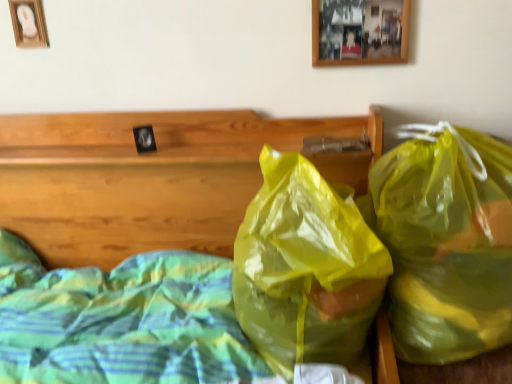
Question: Is translucent yellow plastic bag at center, which is counted as the second plastic bag, starting from the right, oriented towards wooden picture frame at upper center, the second picture frame positioned from the left?

Choices:
 (A) yes
 (B) no

Answer: (B)

Question: From the image's perspective, does translucent yellow plastic bag at center, which is counted as the second plastic bag, starting from the right, appear lower than wooden picture frame at upper center, acting as the 2th picture frame starting from the back?

Choices:
 (A) no
 (B) yes

Answer: (B)

Question: From a real-world perspective, does translucent yellow plastic bag at center, which is counted as the second plastic bag, starting from the right, sit lower than wooden picture frame at upper center, the second picture frame positioned from the left?

Choices:
 (A) yes
 (B) no

Answer: (A)

Question: Is translucent yellow plastic bag at center, which is counted as the second plastic bag, starting from the right, positioned in front of wooden picture frame at upper center, the second picture frame positioned from the left?

Choices:
 (A) no
 (B) yes

Answer: (B)

Question: From the image's perspective, is translucent yellow plastic bag at center, marked as the 1th plastic bag in a left-to-right arrangement, over wooden picture frame at upper center, the 1th picture frame positioned from the front?

Choices:
 (A) no
 (B) yes

Answer: (A)

Question: Does translucent yellow plastic bag at center, marked as the 1th plastic bag in a left-to-right arrangement, have a lesser width compared to wooden picture frame at upper center, the second picture frame positioned from the left?

Choices:
 (A) yes
 (B) no

Answer: (B)

Question: Is translucent yellow plastic bag at right, which is counted as the 1th plastic bag, starting from the right, taller than translucent plastic bags at center?

Choices:
 (A) yes
 (B) no

Answer: (B)

Question: Is translucent plastic bags at center located within translucent yellow plastic bag at right, the second plastic bag viewed from the left?

Choices:
 (A) no
 (B) yes

Answer: (A)

Question: From the image's perspective, is translucent yellow plastic bag at right, which is counted as the 1th plastic bag, starting from the right, under translucent plastic bags at center?

Choices:
 (A) yes
 (B) no

Answer: (B)

Question: From a real-world perspective, does translucent yellow plastic bag at right, the second plastic bag viewed from the left, stand above translucent plastic bags at center?

Choices:
 (A) no
 (B) yes

Answer: (A)

Question: Is translucent yellow plastic bag at right, which is counted as the 1th plastic bag, starting from the right, positioned behind translucent plastic bags at center?

Choices:
 (A) no
 (B) yes

Answer: (B)

Question: From the image's perspective, does wooden picture frame at upper center, the second picture frame positioned from the left, appear lower than translucent plastic bags at center?

Choices:
 (A) no
 (B) yes

Answer: (A)